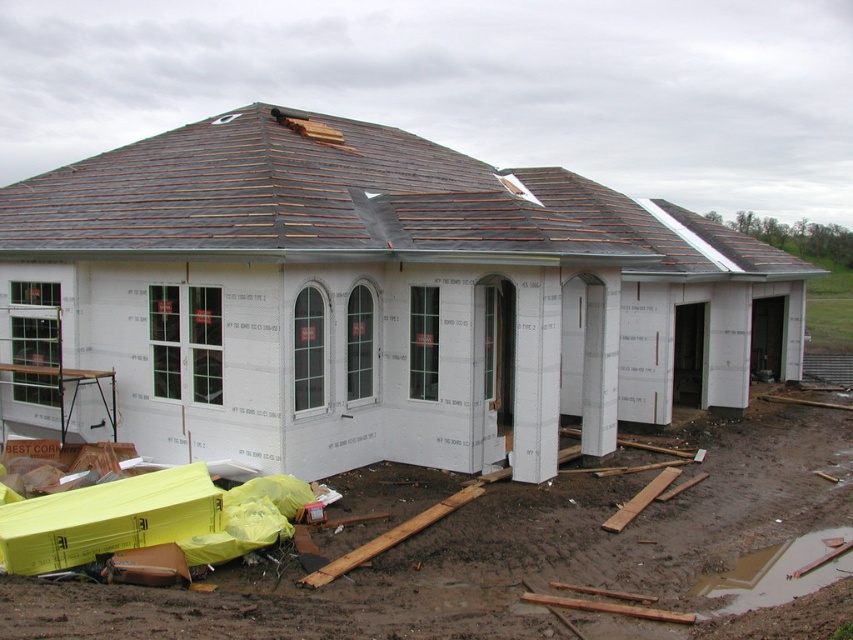
Question: Is white foam insulation at center positioned behind shiny brown shingles at upper center?

Choices:
 (A) no
 (B) yes

Answer: (A)

Question: Can you confirm if white foam insulation at center is positioned above shiny brown shingles at upper center?

Choices:
 (A) no
 (B) yes

Answer: (A)

Question: Which of the following is the closest to the observer?

Choices:
 (A) (445, 195)
 (B) (352, 253)

Answer: (B)

Question: Which of the following is the closest to the observer?

Choices:
 (A) (88, 243)
 (B) (434, 204)

Answer: (A)

Question: Can you confirm if white foam insulation at center is positioned below shiny brown shingles at upper center?

Choices:
 (A) no
 (B) yes

Answer: (B)